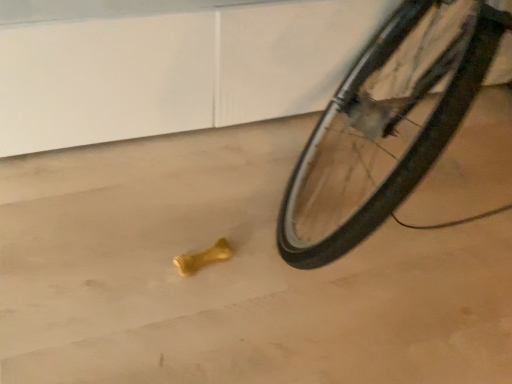
The width and height of the screenshot is (512, 384). I want to click on black rubber bicycle wheel at lower right, so click(x=394, y=122).

The width and height of the screenshot is (512, 384). What do you see at coordinates (394, 122) in the screenshot? I see `black rubber bicycle wheel at lower right` at bounding box center [394, 122].

What is the approximate height of black rubber bicycle wheel at lower right?

The height of black rubber bicycle wheel at lower right is 31.73 inches.

The height and width of the screenshot is (384, 512). What are the coordinates of `black rubber bicycle wheel at lower right` in the screenshot? It's located at 394,122.